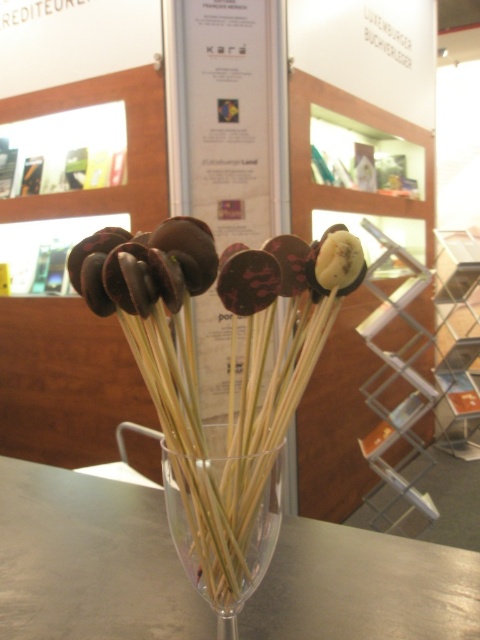
Is transparent glass vase at center below chocolate-coated banana at center?

Yes.

Is transparent glass vase at center wider than chocolate-coated banana at center?

Yes.

Does point (166, 488) come farther from viewer compared to point (240, 300)?

Yes, point (166, 488) is behind point (240, 300).

This screenshot has width=480, height=640. Find the location of `transparent glass vase at center`. transparent glass vase at center is located at coordinates (249, 545).

Can you confirm if transparent glass table at center is bigger than chocolate-coated banana at center?

Indeed, transparent glass table at center has a larger size compared to chocolate-coated banana at center.

Is point (196, 596) closer to viewer compared to point (223, 272)?

No, (196, 596) is behind (223, 272).

Where is `transparent glass table at center`? transparent glass table at center is located at coordinates (90, 561).

Between transparent glass table at center and transparent glass vase at center, which one appears on the left side from the viewer's perspective?

From the viewer's perspective, transparent glass table at center appears more on the left side.

Between transparent glass table at center and transparent glass vase at center, which one has more height?

Standing taller between the two is transparent glass vase at center.

Who is more forward, (313, 579) or (275, 470)?

Point (275, 470) is more forward.

Locate an element on the screen. The width and height of the screenshot is (480, 640). transparent glass table at center is located at coordinates (90, 561).